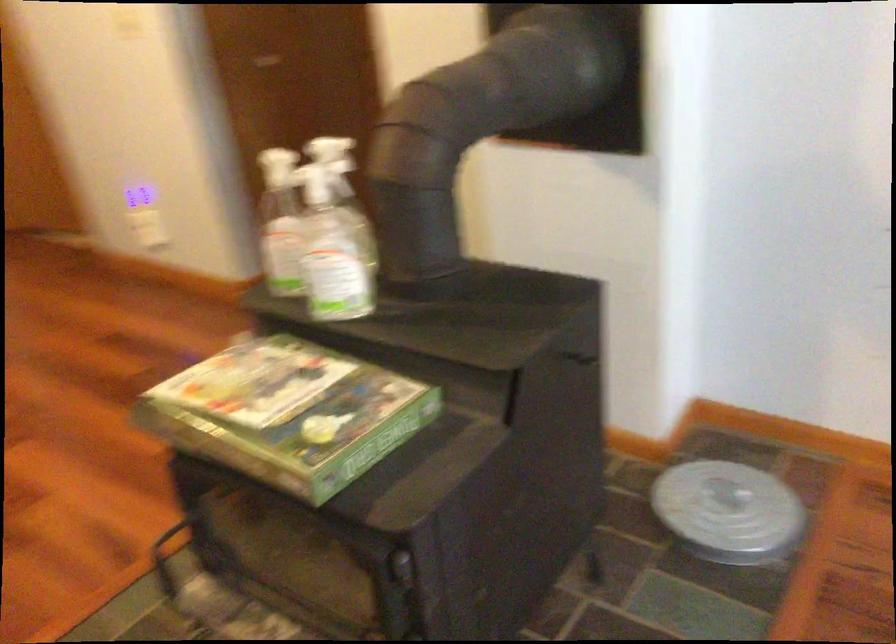
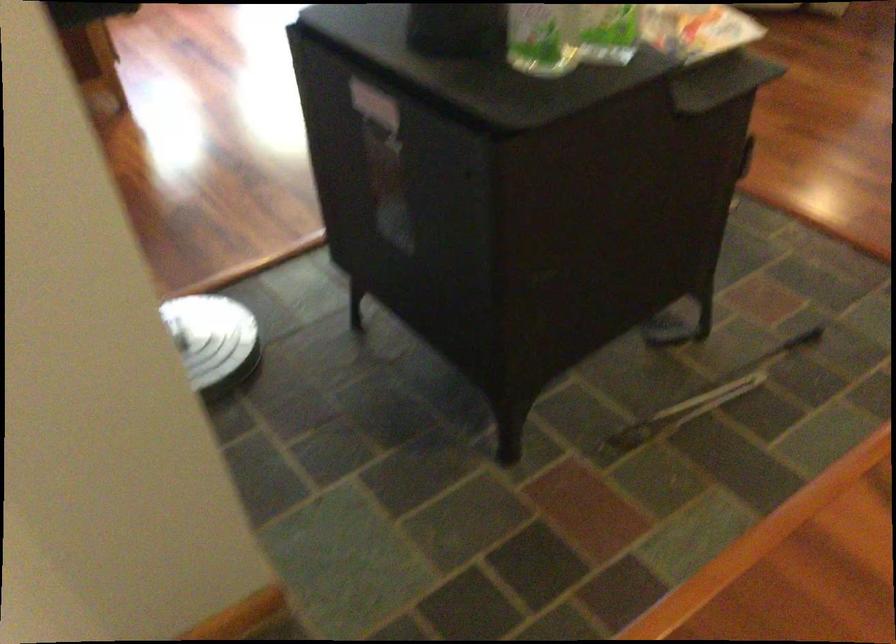
Where in the second image is the point corresponding to (478,279) from the first image?

(375, 104)